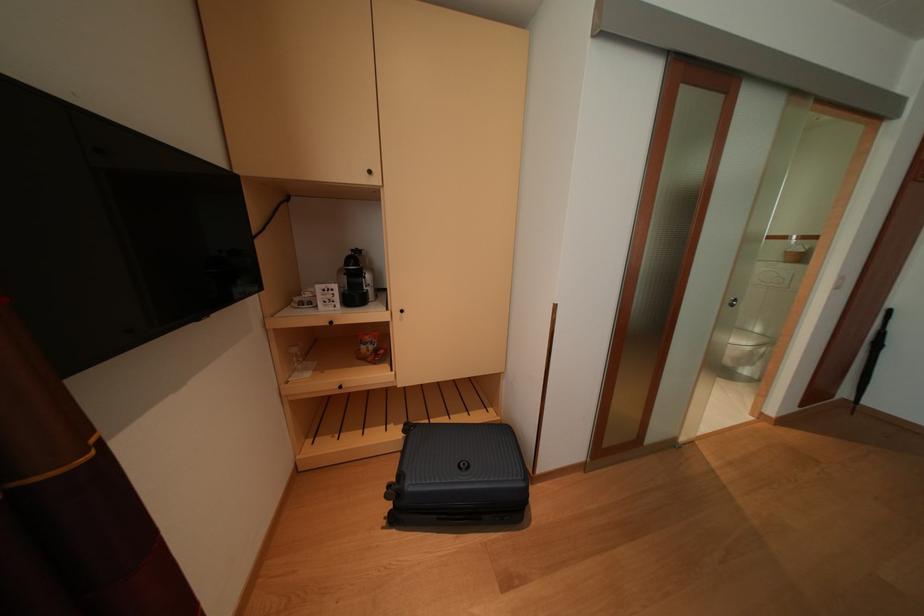
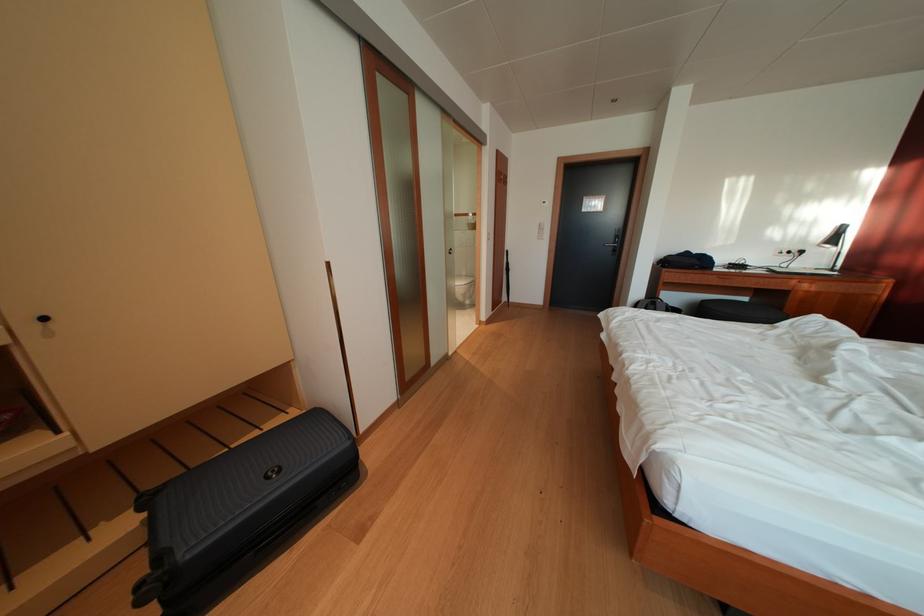
Find the pixel in the second image that matches point 408,482 in the first image.

(167, 562)